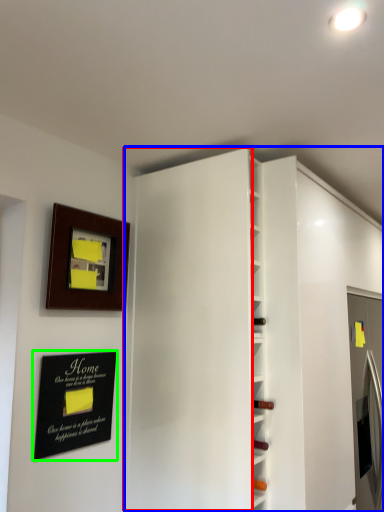
Question: Which is farther away from door (highlighted by a red box)? bookshelf (highlighted by a blue box) or plaque (highlighted by a green box)?

Choices:
 (A) bookshelf
 (B) plaque

Answer: (B)